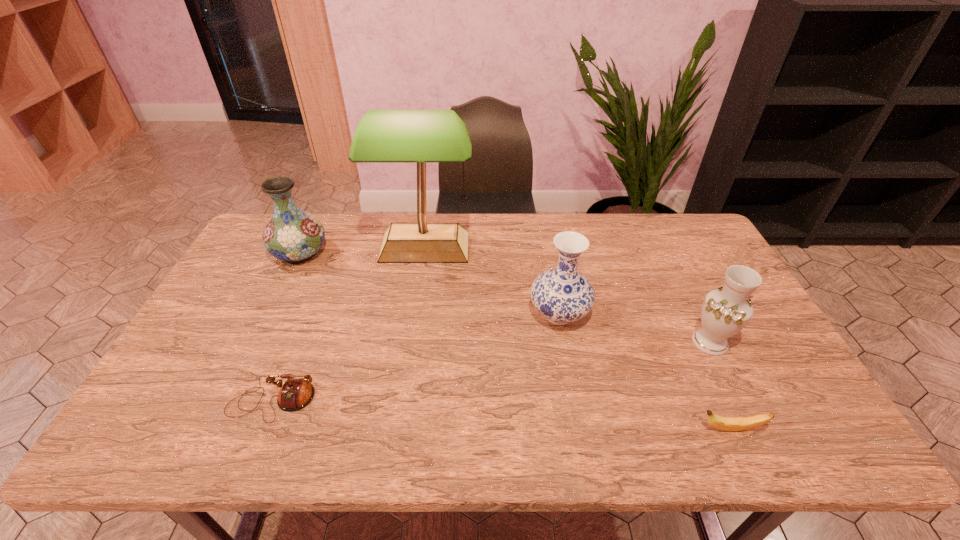
You are a GUI agent. You are given a task and a screenshot of the screen. Output one action in this format:
    pyautogui.click(x=<x>, y=<y>)
    Task: Click on the tallest object
    The image size is (960, 540).
    Given the screenshot: What is the action you would take?
    pyautogui.click(x=421, y=136)

Locate an element on the screen. table lamp is located at coordinates (421, 136).

The image size is (960, 540). Find the location of `the leftmost vase`. the leftmost vase is located at coordinates click(x=293, y=235).

At what (x,y) coordinates should I click in order to perform the action: click on the second vase from left to right. Please return your answer as a coordinate pair (x, y). Looking at the image, I should click on 562,295.

Find the location of a particular element. Image resolution: width=960 pixels, height=540 pixels. the rightmost vase is located at coordinates (725, 311).

The height and width of the screenshot is (540, 960). I want to click on the fifth farthest object, so click(x=295, y=394).

Find the location of a particular element. This screenshot has height=540, width=960. the nearest object is located at coordinates (722, 423).

The image size is (960, 540). I want to click on free space located 0.090m on the metallic stand of the tallest object, so click(419, 292).

Where is `vacant space located on the right of the farthest vase`? Image resolution: width=960 pixels, height=540 pixels. vacant space located on the right of the farthest vase is located at coordinates (349, 253).

Identify the location of vacant space situated on the right of the second vase from right to left. Image resolution: width=960 pixels, height=540 pixels. tap(677, 314).